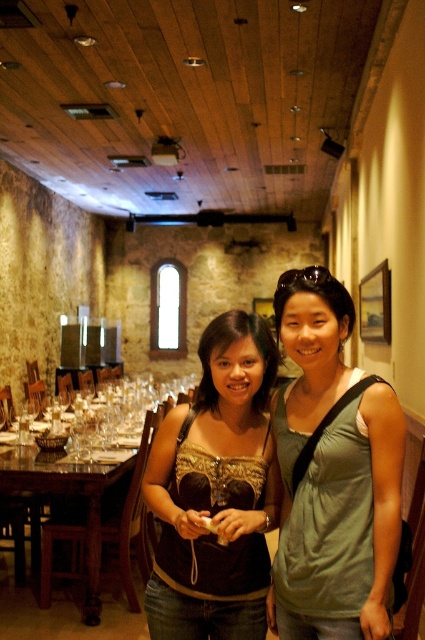
You are a photographer trying to capture the two people in the image. Which person should you focus on first if you want to photograph the green fabric tank top at center and the brown fabric top at center from left to right order?

The brown fabric top at center should be focused on first because it is positioned to the left of the green fabric tank top at center.

Looking at this image, you are a photographer setting up for a group photo in this restaurant. You need to ensure that all subjects are visible. Given that the green fabric tank top at center and brown fabric top at center are both in the frame, which one is more likely to be fully visible if you adjust the camera angle slightly to the right?

The green fabric tank top at center is more likely to be fully visible because it occupies less space than the brown fabric top at center, so adjusting the camera angle to the right might allow more of it to stay in frame without obstruction.

You are a photographer setting up for a group photo. You need to place a 10 cm wide camera tripod between the brown fabric top at center and the wooden polished table at center. Which object should the tripod be placed closer to?

The brown fabric top at center is thinner than the wooden polished table at center, so the tripod should be placed closer to the wooden polished table at center to ensure stability.